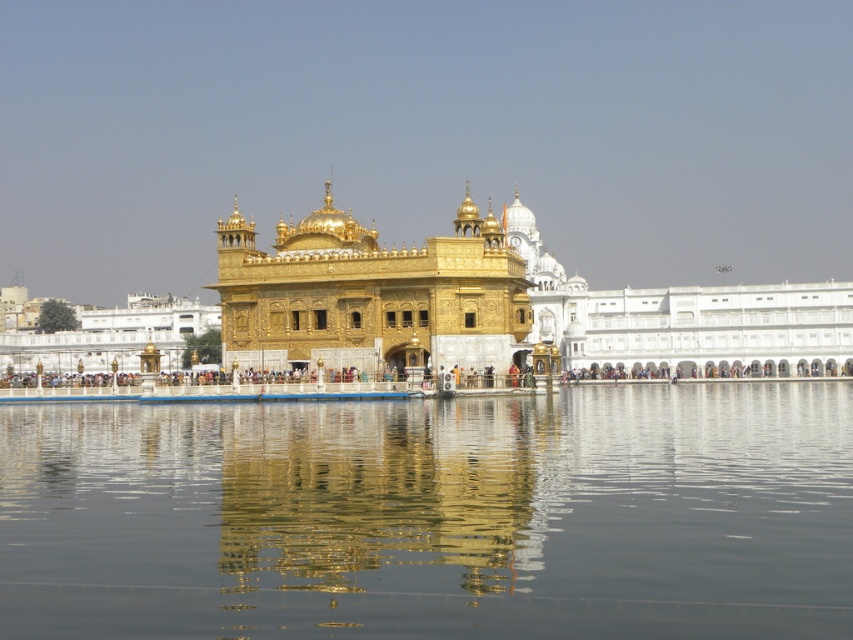
You are a visitor at the Golden Temple and want to know if the reflection of the gold shiny palace at center in the transparent liquid water at center is fully visible. Based on the scene description, can you determine if the reflection is complete?

The transparent liquid water at center has a lesser height compared to gold shiny palace at center, so the reflection of the gold shiny palace at center in the transparent liquid water at center would be incomplete because the water level is not high enough to mirror the entire structure.

You are standing in front of the Golden Temple and want to take a photo that includes both the transparent liquid water at center and the gold shiny palace at center. Which object will appear larger in the photo?

The transparent liquid water at center will appear larger in the photo because it is closer to the viewer than the gold shiny palace at center.

You are planning to visit the Golden Temple and want to know if the transparent liquid water at center can fully surround the gold shiny palace at center. Based on the scene description, can it?

The transparent liquid water at center has a smaller width than the gold shiny palace at center, so it cannot fully surround the gold shiny palace at center.